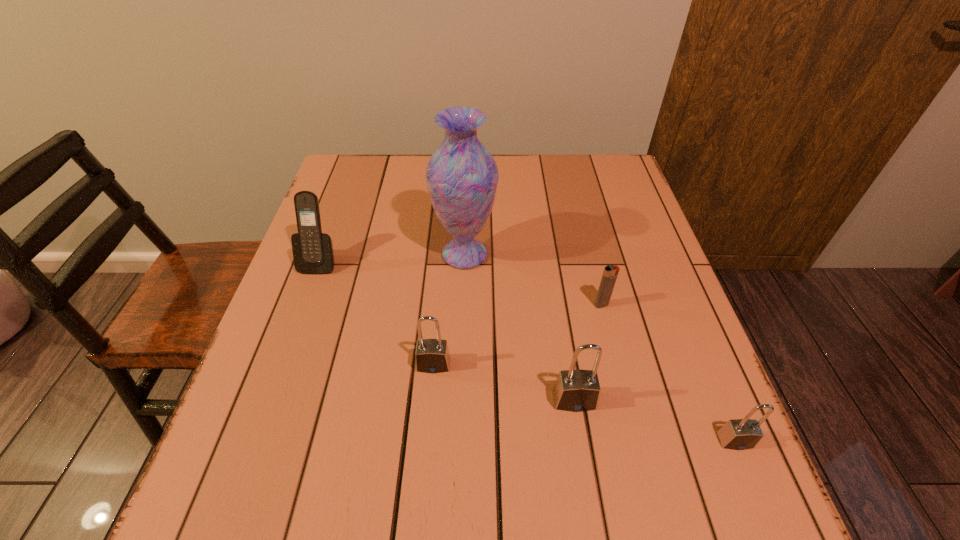
At what (x,y) coordinates should I click in order to perform the action: click on vacant place for an extra padlock on the left. Please return your answer as a coordinate pair (x, y). Looking at the image, I should click on (309, 333).